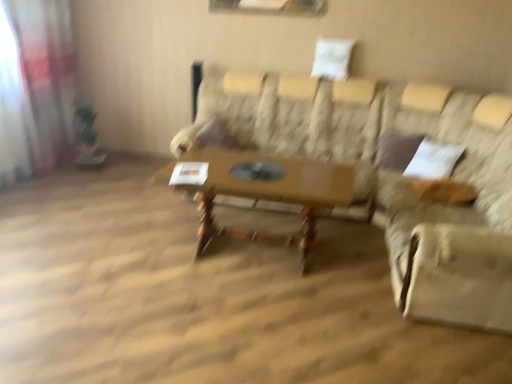
This screenshot has width=512, height=384. Find the location of `vacant space to the left of wooden table at center`. vacant space to the left of wooden table at center is located at coordinates (124, 252).